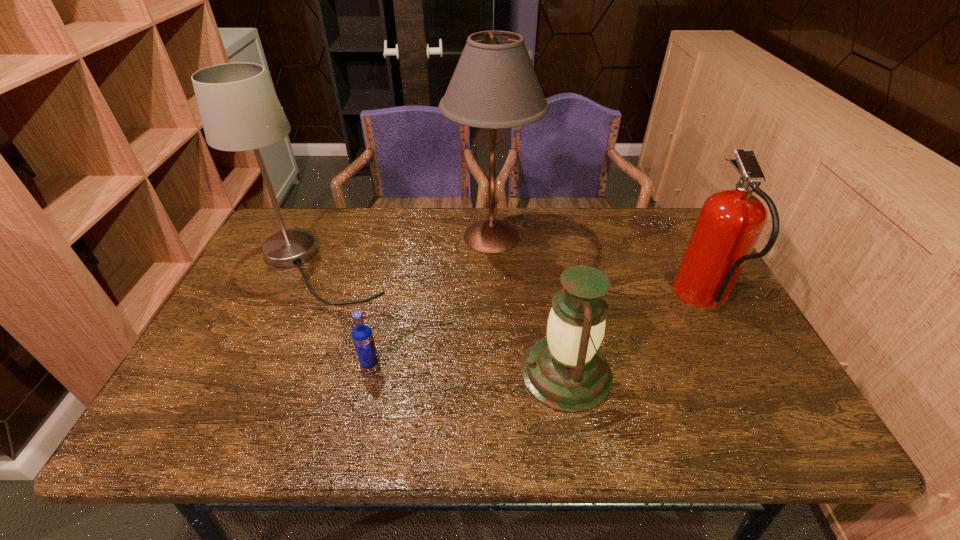
Where is `free space located with the handle and nozzle on the third tallest object`? Image resolution: width=960 pixels, height=540 pixels. free space located with the handle and nozzle on the third tallest object is located at coordinates (529, 300).

The image size is (960, 540). In order to click on free spot located 0.070m with the handle and nozzle on the third tallest object in this screenshot , I will do click(652, 300).

Locate an element on the screen. The width and height of the screenshot is (960, 540). vacant area located with the handle and nozzle on the third tallest object is located at coordinates (559, 300).

At what (x,y) coordinates should I click in order to perform the action: click on free region located 0.190m with the light compartment facing forward on the lantern. Please return your answer as a coordinate pair (x, y). Looking at the image, I should click on (438, 373).

The image size is (960, 540). In order to click on free region located with the light compartment facing forward on the lantern in this screenshot , I will do `click(385, 373)`.

Locate an element on the screen. vacant space located 0.170m with the light compartment facing forward on the lantern is located at coordinates (446, 373).

Locate an element on the screen. Image resolution: width=960 pixels, height=540 pixels. vacant region located 0.070m on the right of the shortest object is located at coordinates (410, 368).

Identify the location of object located at the near edge. The height and width of the screenshot is (540, 960). pyautogui.click(x=565, y=371).

Find the location of a particular element. The image size is (960, 540). object located at the left edge is located at coordinates (239, 109).

Where is `object that is at the right edge`? object that is at the right edge is located at coordinates coord(730,223).